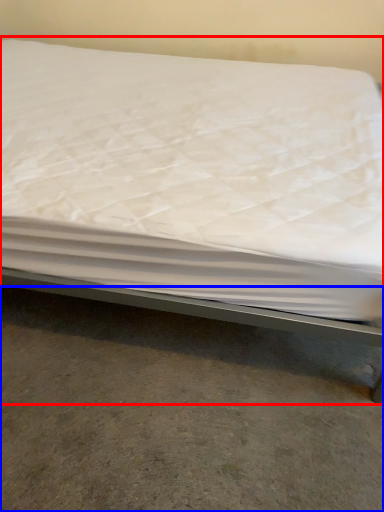
Question: Which object is closer to the camera taking this photo, bed (highlighted by a red box) or concrete (highlighted by a blue box)?

Choices:
 (A) bed
 (B) concrete

Answer: (A)